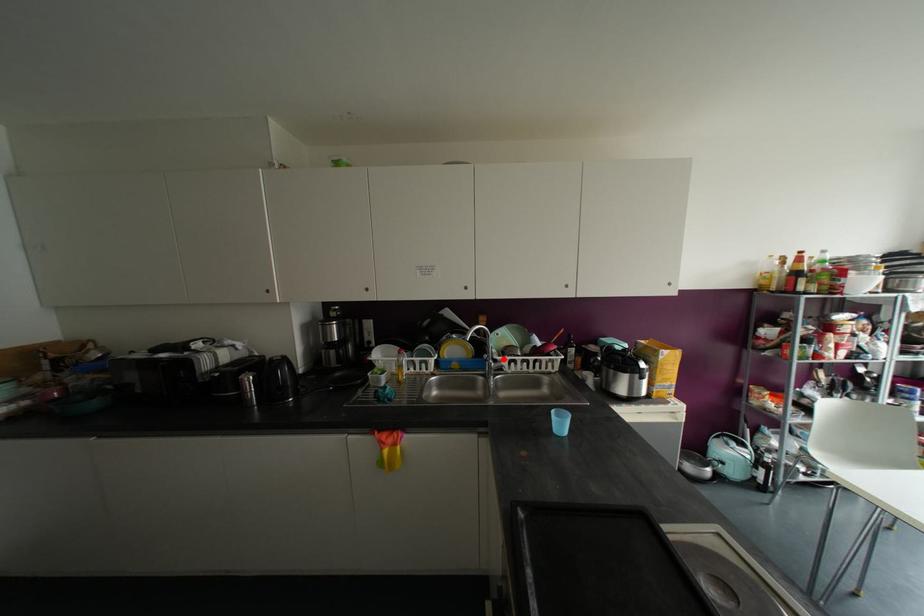
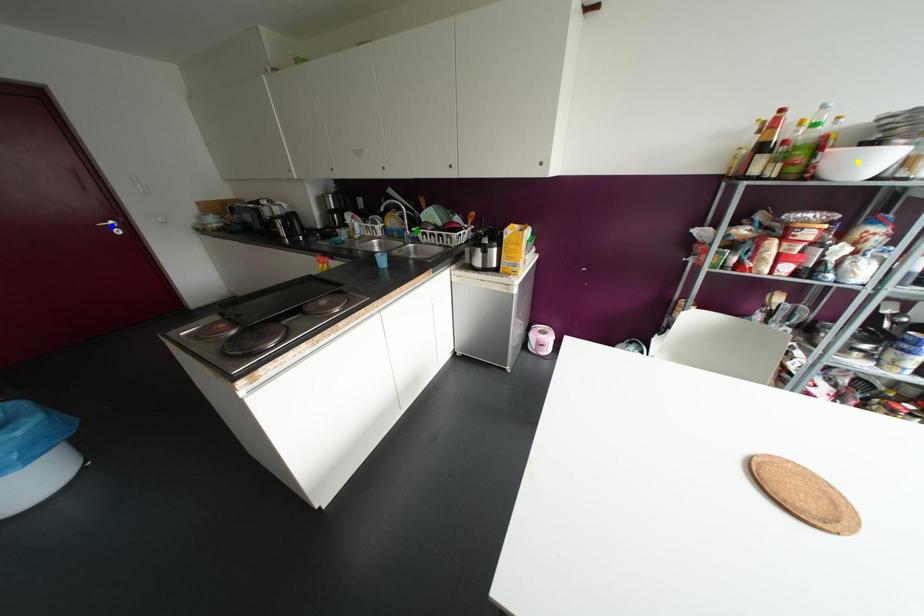
Question: I am providing you with two images of the same scene from different viewpoints. A red point is marked on the first image. You are given multiple points on the second image. Which point in image 2 is actually the same real-world point as the red point in image 1?

Choices:
 (A) green point
 (B) yellow point
 (C) blue point

Answer: (A)